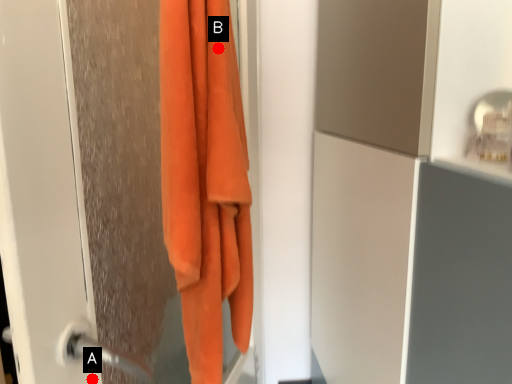
Question: Two points are circled on the image, labeled by A and B beside each circle. Which point is farther from the camera taking this photo?

Choices:
 (A) A is further
 (B) B is further

Answer: (B)